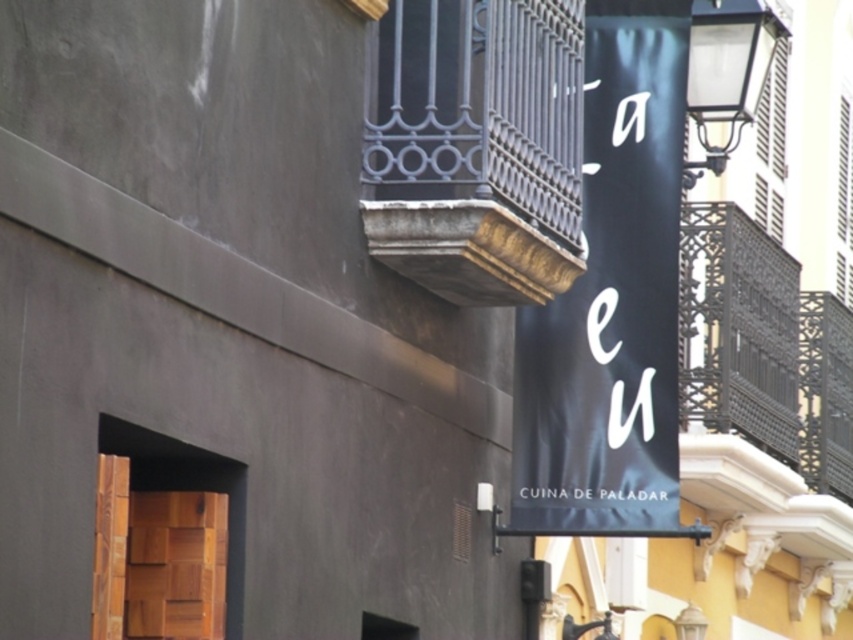
You are a window cleaner with a 2.5 meter ladder. You need to clean the black fabric banner at center and the dark wrought iron balcony at upper center. Which object will require you to climb higher on the ladder?

The black fabric banner at center is taller than the dark wrought iron balcony at upper center, so you will need to climb higher on the ladder to reach the black fabric banner at center.

You are a painter who needs to decide which object to paint first between the black fabric banner at center and the dark wrought iron balcony at upper center. Based on their sizes, which one should you choose to paint first?

The black fabric banner at center has a larger size compared to the dark wrought iron balcony at upper center, so you should paint the black fabric banner at center first.

You are standing in front of the building and want to see the dark wrought iron balcony at upper center. Is it visible behind the black fabric banner at center?

The dark wrought iron balcony at upper center is behind the black fabric banner at center, so it might not be fully visible from the front.